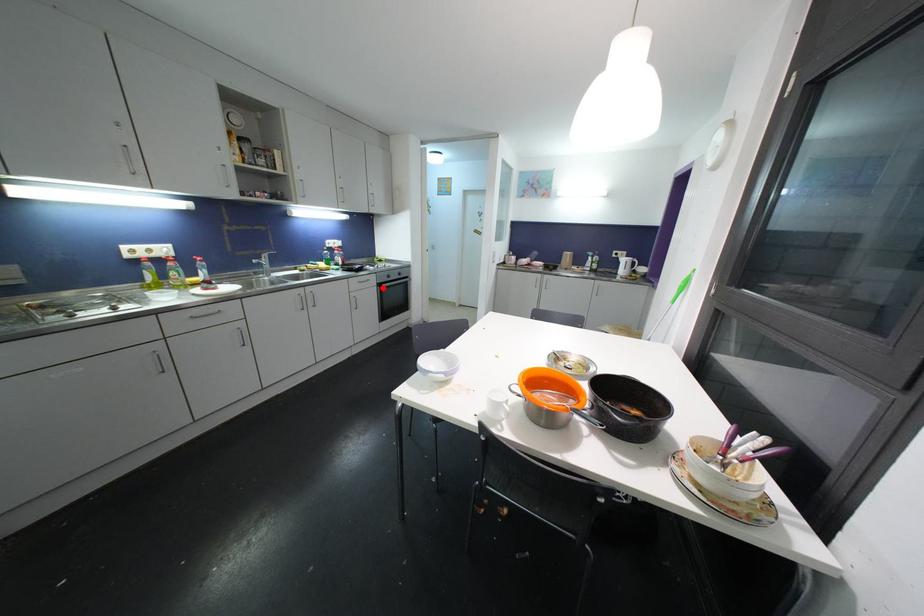
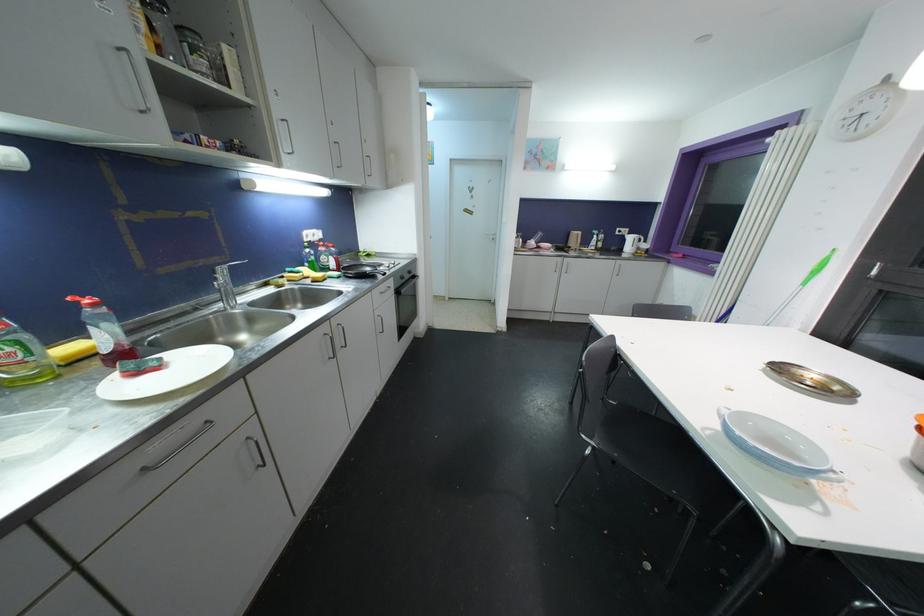
Find the pixel in the second image that matches the highlighted location in the first image.

(400, 294)